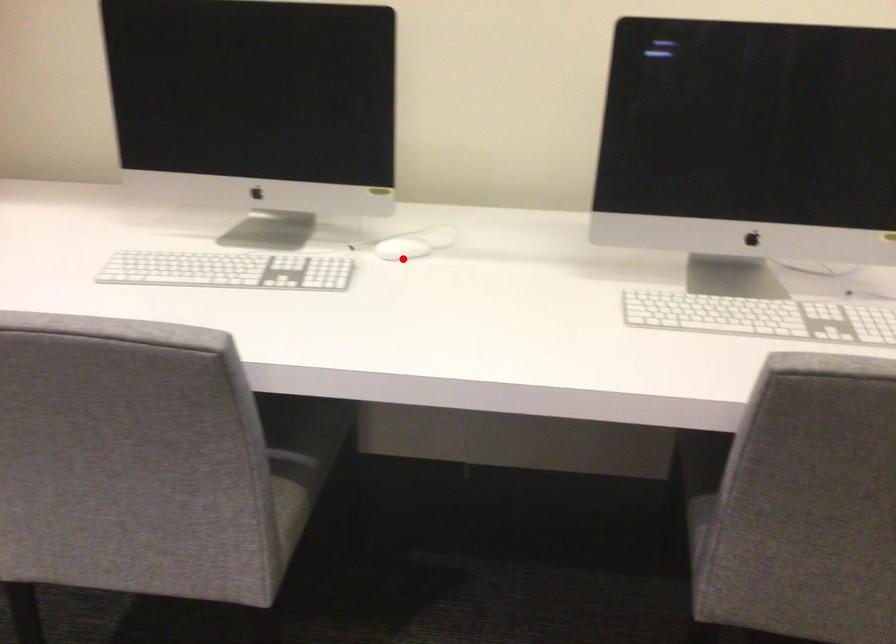
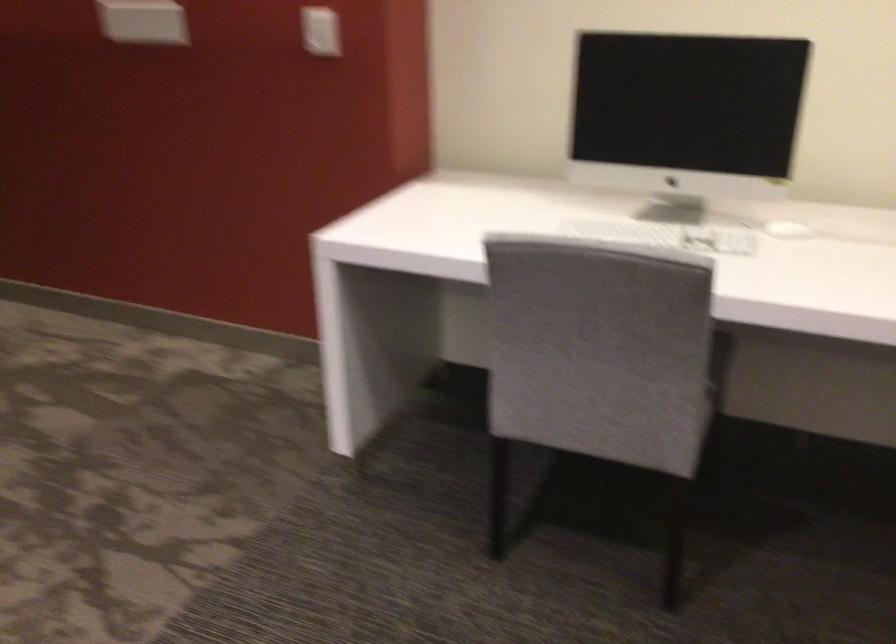
Locate, in the second image, the point that corresponds to the highlighted location in the first image.

(786, 230)